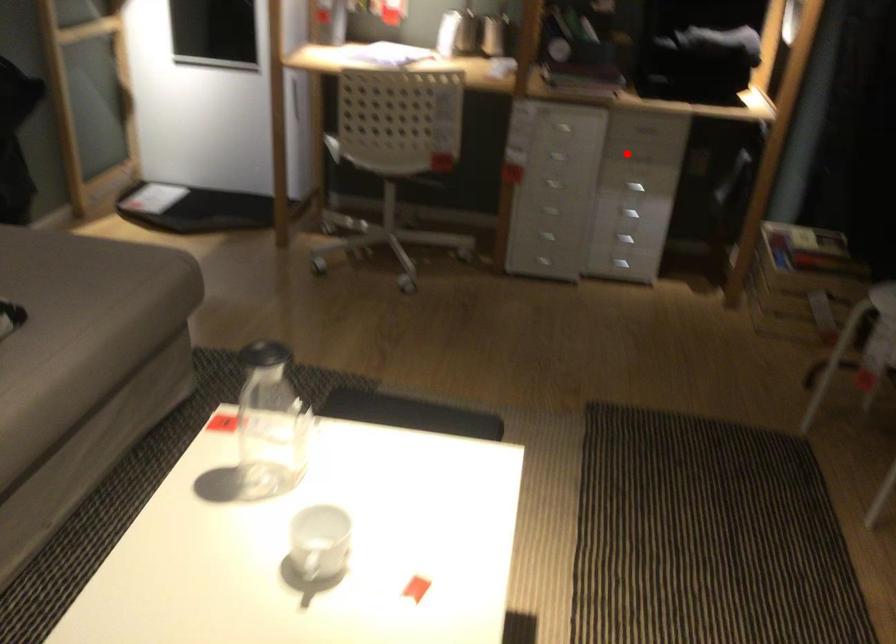
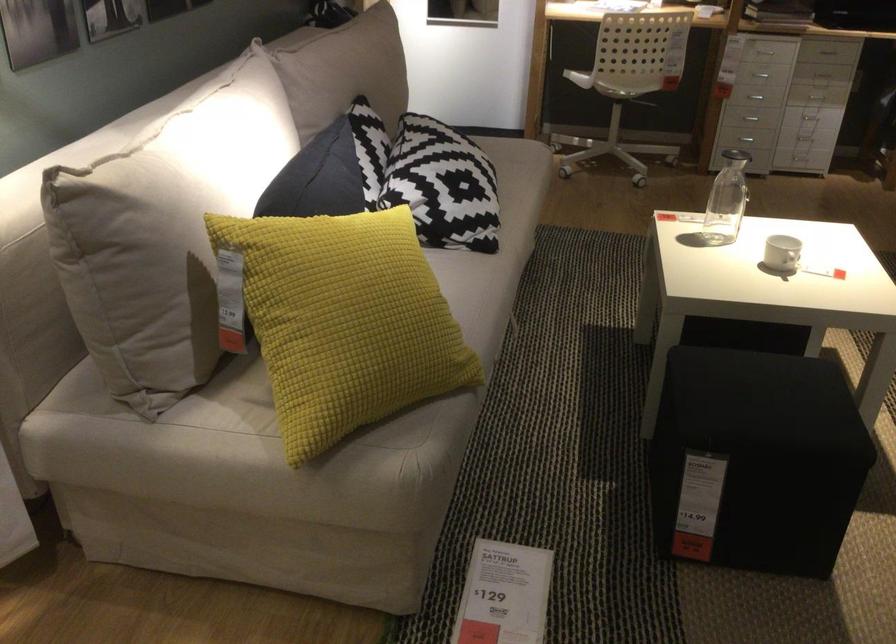
In the second image, find the point that corresponds to the highlighted location in the first image.

(826, 51)